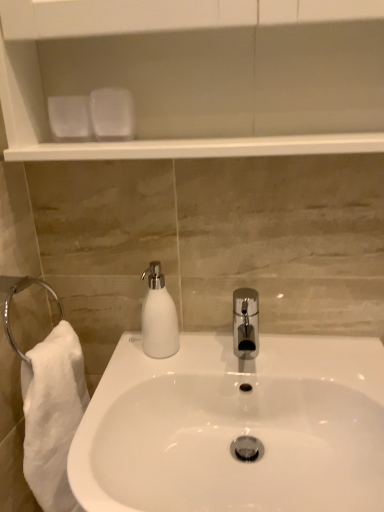
Image resolution: width=384 pixels, height=512 pixels. I want to click on white glossy sink at center, so tap(235, 426).

Describe the element at coordinates (235, 426) in the screenshot. Image resolution: width=384 pixels, height=512 pixels. I see `white glossy sink at center` at that location.

At what (x,y) coordinates should I click in order to perform the action: click on white matte soap dispenser at center. Please return your answer as a coordinate pair (x, y). Image resolution: width=384 pixels, height=512 pixels. Looking at the image, I should click on (158, 316).

What do you see at coordinates (158, 316) in the screenshot? Image resolution: width=384 pixels, height=512 pixels. I see `white matte soap dispenser at center` at bounding box center [158, 316].

Find the location of a particular element. white glossy sink at center is located at coordinates (235, 426).

Between white glossy sink at center and white matte soap dispenser at center, which one appears on the right side from the viewer's perspective?

white glossy sink at center.

Which object is further away from the camera, white glossy sink at center or white matte soap dispenser at center?

white matte soap dispenser at center is further from the camera.

Between point (281, 451) and point (168, 313), which one is positioned in front?

The point (281, 451) is in front.

From the image's perspective, is white glossy sink at center beneath white matte soap dispenser at center?

Yes.

From a real-world perspective, is white glossy sink at center positioned under white matte soap dispenser at center based on gravity?

Correct, in the physical world, white glossy sink at center is lower than white matte soap dispenser at center.

Between white glossy sink at center and white matte soap dispenser at center, which one has larger width?

With larger width is white glossy sink at center.

Considering the relative sizes of white glossy sink at center and white matte soap dispenser at center in the image provided, is white glossy sink at center shorter than white matte soap dispenser at center?

Incorrect, the height of white glossy sink at center does not fall short of that of white matte soap dispenser at center.

Is white glossy sink at center bigger or smaller than white matte soap dispenser at center?

white glossy sink at center is bigger than white matte soap dispenser at center.

Would you say white glossy sink at center is inside or outside white matte soap dispenser at center?

white glossy sink at center cannot be found inside white matte soap dispenser at center.

Is white glossy sink at center far away from white matte soap dispenser at center?

No.

Is white glossy sink at center turned away from white matte soap dispenser at center?

No, white glossy sink at center's orientation is not away from white matte soap dispenser at center.

Identify the location of sink that is below the white matte soap dispenser at center (from the image's perspective). (235, 426).

Based on the photo, is white matte soap dispenser at center at the right side of white glossy sink at center?

In fact, white matte soap dispenser at center is to the left of white glossy sink at center.

Based on the photo, considering the positions of objects white matte soap dispenser at center and white glossy sink at center in the image provided, who is in front, white matte soap dispenser at center or white glossy sink at center?

white glossy sink at center.

Does point (147, 294) appear closer or farther from the camera than point (174, 468)?

Point (147, 294) appears to be farther away from the viewer than point (174, 468).

From the image's perspective, is white matte soap dispenser at center located above or below white glossy sink at center?

From the image's perspective, white matte soap dispenser at center appears above white glossy sink at center.

From a real-world perspective, is white matte soap dispenser at center above or below white glossy sink at center?

From a real-world perspective, white matte soap dispenser at center is physically above white glossy sink at center.

Is white matte soap dispenser at center thinner than white glossy sink at center?

Correct, the width of white matte soap dispenser at center is less than that of white glossy sink at center.

Can you confirm if white matte soap dispenser at center is shorter than white glossy sink at center?

Yes, white matte soap dispenser at center is shorter than white glossy sink at center.

Considering the sizes of objects white matte soap dispenser at center and white glossy sink at center in the image provided, who is bigger, white matte soap dispenser at center or white glossy sink at center?

white glossy sink at center is bigger.

Is white glossy sink at center completely or partially inside white matte soap dispenser at center?

No, white matte soap dispenser at center does not contain white glossy sink at center.

Is white matte soap dispenser at center far from white glossy sink at center?

white matte soap dispenser at center is near white glossy sink at center, not far away.

Is white matte soap dispenser at center positioned with its back to white glossy sink at center?

That's not correct — white matte soap dispenser at center is not looking away from white glossy sink at center.

The image size is (384, 512). In order to click on sink below the white matte soap dispenser at center (from the image's perspective) in this screenshot , I will do `click(235, 426)`.

Find the location of a particular element. The height and width of the screenshot is (512, 384). sink that appears on the right of white matte soap dispenser at center is located at coordinates (235, 426).

The width and height of the screenshot is (384, 512). I want to click on soap dispenser behind the white glossy sink at center, so click(158, 316).